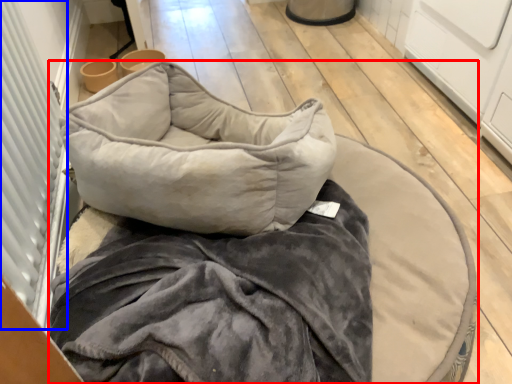
Question: Which object is further to the camera taking this photo, furniture (highlighted by a red box) or screen door (highlighted by a blue box)?

Choices:
 (A) furniture
 (B) screen door

Answer: (A)